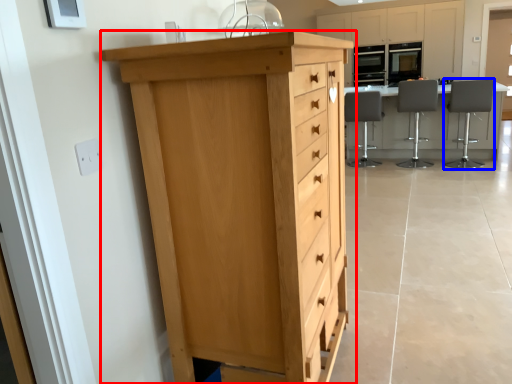
Question: Which of the following is the closest to the observer, chest of drawers (highlighted by a red box) or chair (highlighted by a blue box)?

Choices:
 (A) chest of drawers
 (B) chair

Answer: (A)